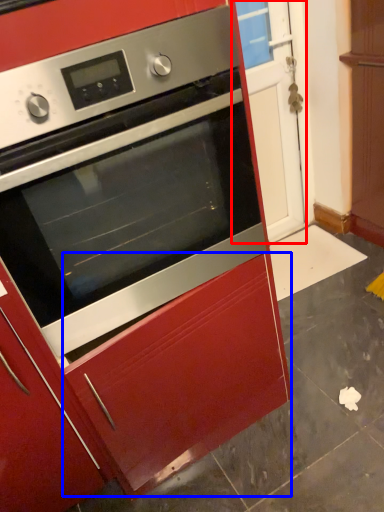
Question: Among these objects, which one is farthest to the camera, glass door (highlighted by a red box) or drawer (highlighted by a blue box)?

Choices:
 (A) glass door
 (B) drawer

Answer: (A)